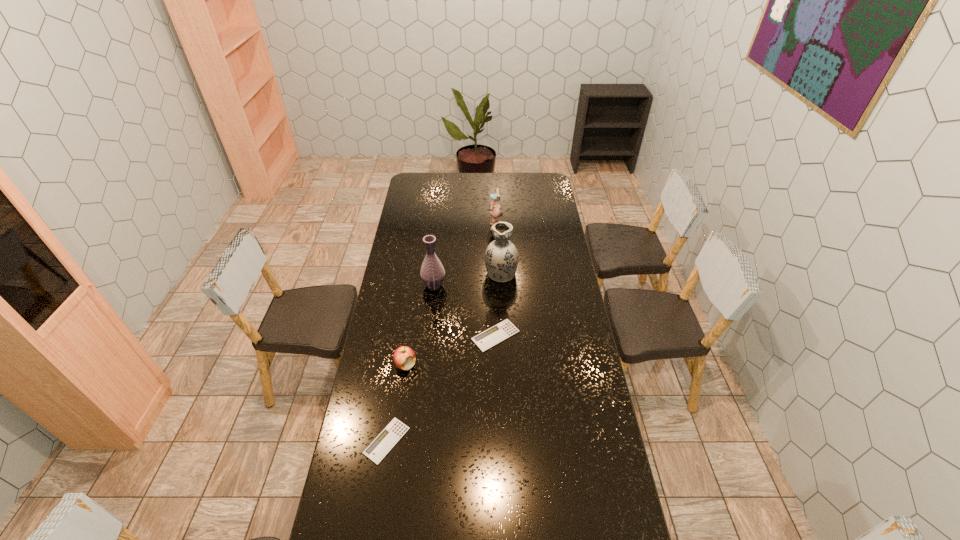
Image resolution: width=960 pixels, height=540 pixels. In order to click on the shorter calculator in this screenshot , I will do `click(376, 451)`.

Locate an element on the screen. The image size is (960, 540). the nearer calculator is located at coordinates (376, 451).

You are a GUI agent. You are given a task and a screenshot of the screen. Output one action in this format:
    pyautogui.click(x=<x>, y=<y>)
    Task: Click on the third nearest object
    
    Given the screenshot: What is the action you would take?
    pyautogui.click(x=485, y=340)

Locate an element on the screen. This screenshot has height=540, width=960. the taller calculator is located at coordinates (485, 340).

The image size is (960, 540). In order to click on the left vase in this screenshot , I will do tap(432, 273).

Locate an element on the screen. The image size is (960, 540). the farthest object is located at coordinates (495, 211).

Locate an element on the screen. The width and height of the screenshot is (960, 540). the fourth shortest object is located at coordinates (495, 211).

Where is `the right vase`? the right vase is located at coordinates (501, 257).

Image resolution: width=960 pixels, height=540 pixels. What are the coordinates of `apple` in the screenshot? It's located at (404, 357).

Find the location of a particular element. the fourth tallest object is located at coordinates (404, 357).